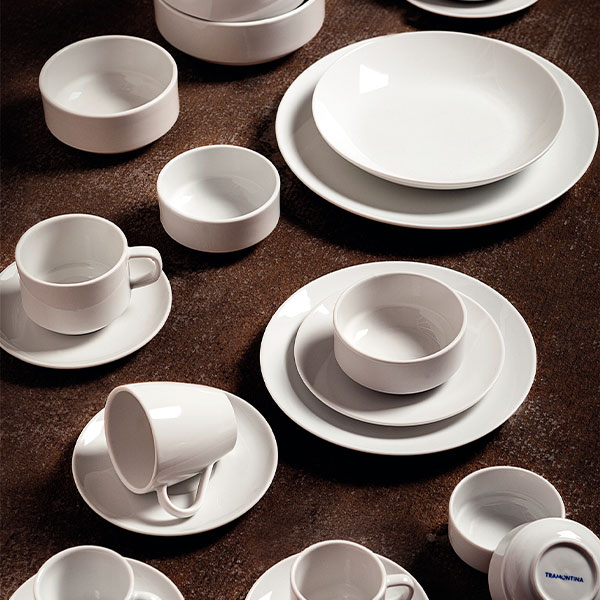
This screenshot has height=600, width=600. I want to click on large serving bowl, so click(x=439, y=170).